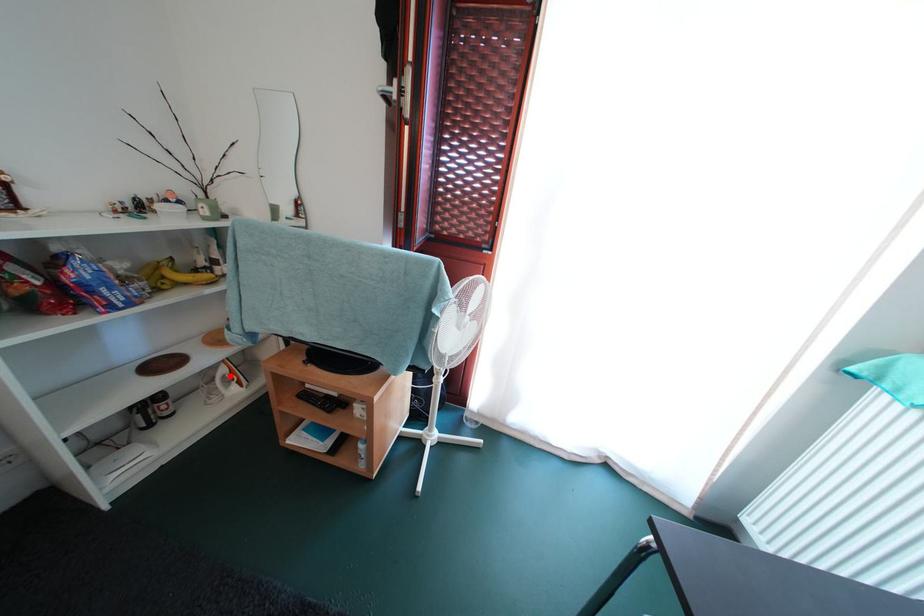
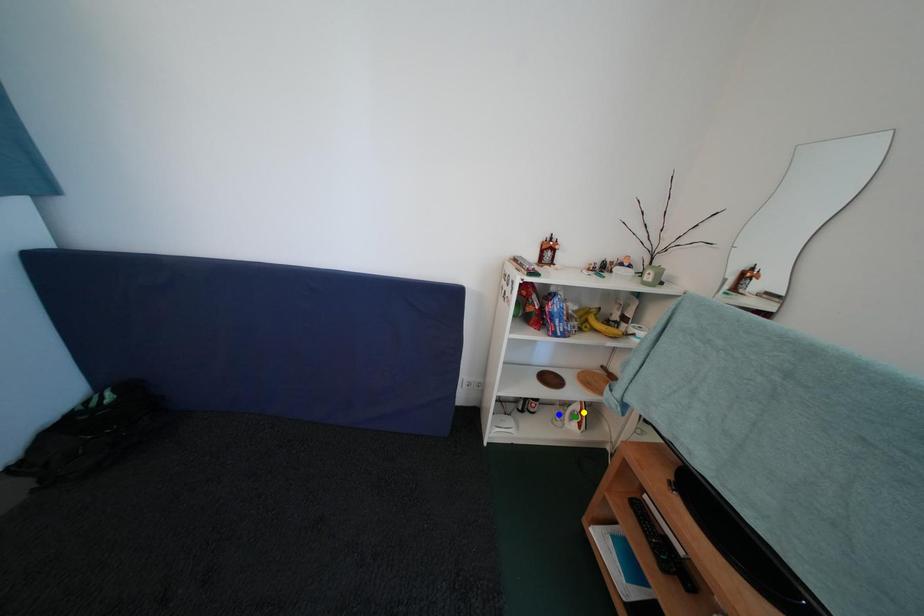
Question: I am providing you with two images of the same scene from different viewpoints. A red point is marked on the first image. You are given multiple points on the second image. Which spot in image 2 lines up with the point in image 1?

Choices:
 (A) green point
 (B) blue point
 (C) yellow point

Answer: (C)